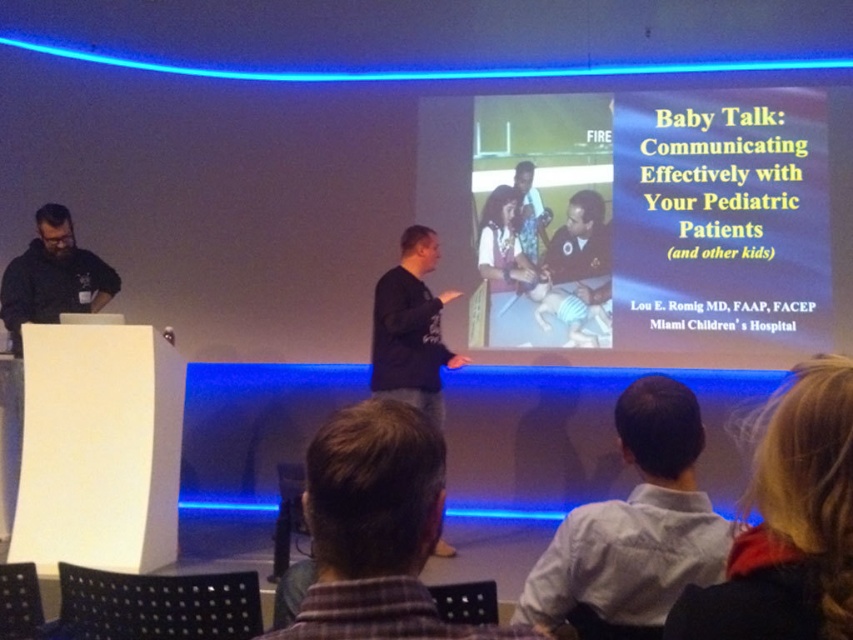
You are organizing a photoshoot in this presentation setting and need to place two mannequins wearing the brown plaid shirt at lower center and the white shirt at lower center. Based on their sizes, which shirt should be placed on the smaller mannequin?

The brown plaid shirt at lower center has a smaller width than the white shirt at lower center, so the smaller mannequin should wear the brown plaid shirt at lower center.

You are sitting in the audience and want to look at both the brown plaid shirt at lower center and the white matte projector screen at center. Which object should you turn your head to the right to see?

To see the white matte projector screen at center, you need to turn your head to the right from the brown plaid shirt at lower center because the white matte projector screen at center is positioned to the right of the brown plaid shirt at lower center.